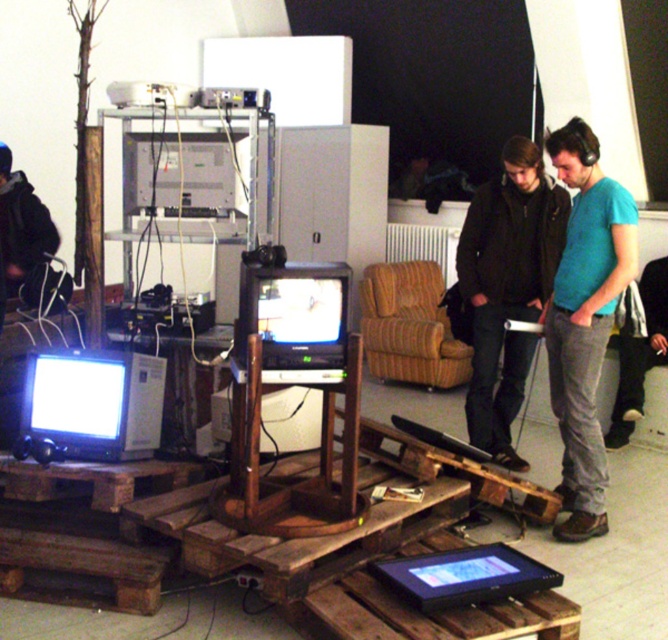
Question: Which is nearer to the matte black monitor at lower left?

Choices:
 (A) dark brown leather jacket at center
 (B) black glossy tablet at lower center

Answer: (B)

Question: Is matte black monitor at lower left above black glossy tablet at lower center?

Choices:
 (A) no
 (B) yes

Answer: (B)

Question: Does teal t-shirt at center have a smaller size compared to matte black monitor at lower left?

Choices:
 (A) no
 (B) yes

Answer: (A)

Question: Which point is farther to the camera?

Choices:
 (A) (599, 228)
 (B) (432, 595)
 (C) (11, 268)
 (D) (49, 378)

Answer: (C)

Question: Does teal t-shirt at center appear on the right side of dark brown leather jacket at center?

Choices:
 (A) no
 (B) yes

Answer: (B)

Question: Based on their relative distances, which object is nearer to the dark brown leather jacket at center?

Choices:
 (A) black leather jacket at lower left
 (B) black glossy tablet at lower center

Answer: (B)